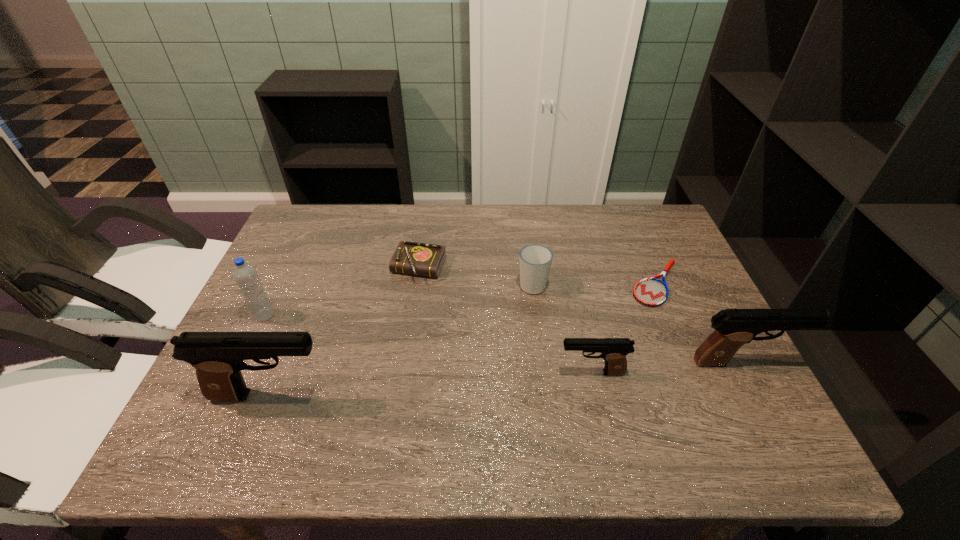
Where is `object at the near edge`? This screenshot has height=540, width=960. object at the near edge is located at coordinates (218, 357).

This screenshot has width=960, height=540. Identify the location of pistol located in the left edge section of the desktop. (218, 357).

This screenshot has width=960, height=540. In order to click on water bottle that is positioned at the left edge in this screenshot , I will do `click(245, 275)`.

The image size is (960, 540). I want to click on pistol positioned at the right edge, so click(x=735, y=327).

Where is `tennis racket present at the right edge`? The image size is (960, 540). tennis racket present at the right edge is located at coordinates (652, 292).

Find the location of a particular element. This screenshot has height=540, width=960. object located at the near left corner is located at coordinates (218, 357).

This screenshot has height=540, width=960. Identify the location of vacant space at the far edge. (392, 231).

Find the location of a particular element. The height and width of the screenshot is (540, 960). free space at the near edge of the desktop is located at coordinates (559, 393).

Image resolution: width=960 pixels, height=540 pixels. I want to click on vacant space at the left edge of the desktop, so click(x=277, y=316).

Where is `free space at the right edge of the desktop`? free space at the right edge of the desktop is located at coordinates (698, 305).